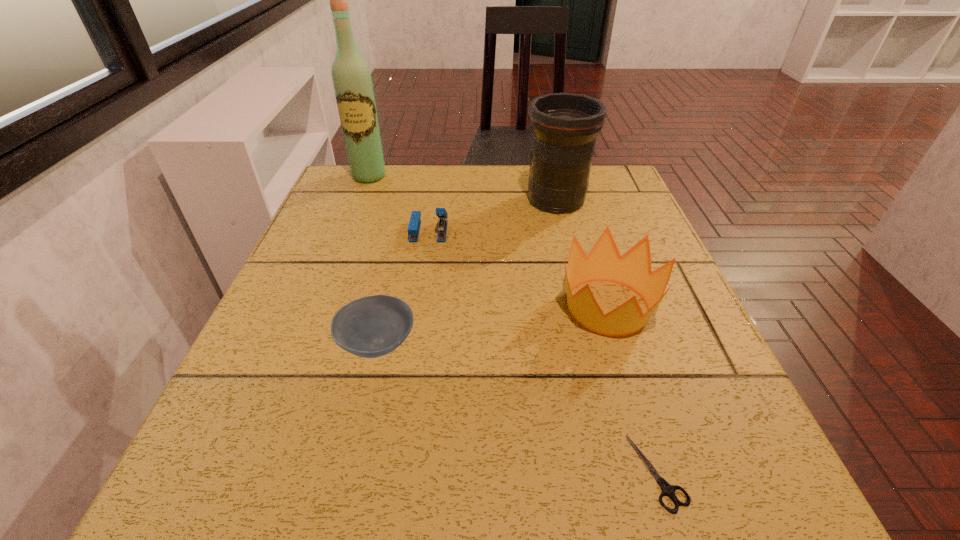
At what (x,y) coordinates should I click in order to perform the action: click on telephoto lens present at the right edge. Please return your answer as a coordinate pair (x, y). The height and width of the screenshot is (540, 960). Looking at the image, I should click on (564, 126).

Where is `crown that is at the right edge`? crown that is at the right edge is located at coordinates (633, 270).

Image resolution: width=960 pixels, height=540 pixels. Identify the location of shears present at the right edge. (668, 490).

Where is `object present at the far left corner`? Image resolution: width=960 pixels, height=540 pixels. object present at the far left corner is located at coordinates (352, 82).

The width and height of the screenshot is (960, 540). What are the coordinates of `object located at the far right corner` in the screenshot? It's located at (564, 126).

Identify the location of object that is positioned at the near right corner. (668, 490).

The height and width of the screenshot is (540, 960). In the image, there is a desktop. What are the coordinates of `free region at the far edge` in the screenshot? It's located at (447, 181).

In the image, there is a desktop. Where is `vacant space at the near edge`? This screenshot has height=540, width=960. vacant space at the near edge is located at coordinates (430, 518).

At what (x,y) coordinates should I click in order to perform the action: click on vacant space at the left edge. Please return your answer as a coordinate pair (x, y). This screenshot has height=540, width=960. Looking at the image, I should click on (243, 435).

Where is `vacant space at the right edge of the desktop`? vacant space at the right edge of the desktop is located at coordinates point(653,263).